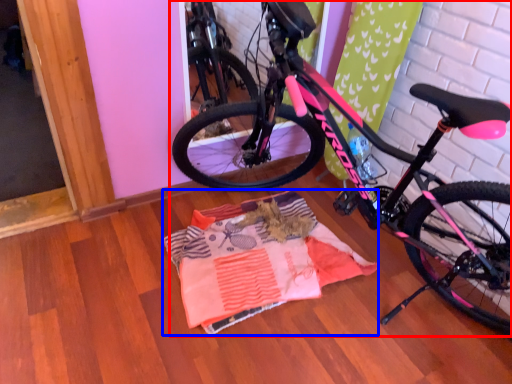
Question: Which object appears farthest to the camera in this image, bicycle (highlighted by a red box) or blanket (highlighted by a blue box)?

Choices:
 (A) bicycle
 (B) blanket

Answer: (B)